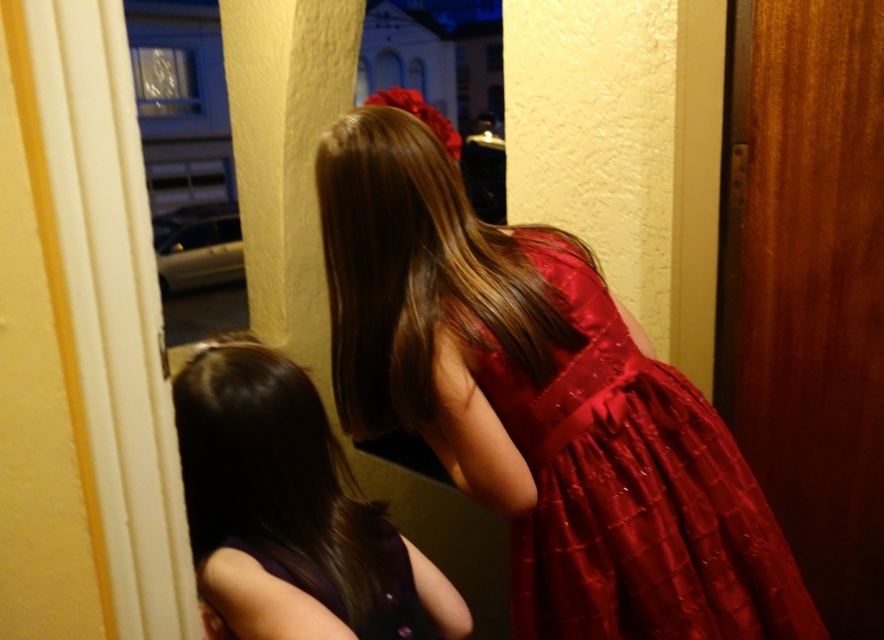
Does shiny red dress at center appear under shiny purple dress at lower left?

Actually, shiny red dress at center is above shiny purple dress at lower left.

In the scene shown: Does shiny red dress at center have a smaller size compared to shiny purple dress at lower left?

No, shiny red dress at center is not smaller than shiny purple dress at lower left.

Does point (713, 445) come in front of point (222, 516)?

No.

The height and width of the screenshot is (640, 884). In order to click on shiny red dress at center in this screenshot , I will do `click(540, 404)`.

Is shiny brown hair at center taller than purple satin dress at lower left?

Correct, shiny brown hair at center is much taller as purple satin dress at lower left.

Between shiny brown hair at center and purple satin dress at lower left, which one has more height?

shiny brown hair at center

The height and width of the screenshot is (640, 884). I want to click on shiny brown hair at center, so click(x=420, y=272).

Based on the photo, is shiny purple dress at lower left wider than purple satin dress at lower left?

Indeed, shiny purple dress at lower left has a greater width compared to purple satin dress at lower left.

Does shiny purple dress at lower left have a lesser height compared to purple satin dress at lower left?

Incorrect, shiny purple dress at lower left's height does not fall short of purple satin dress at lower left's.

Who is more distant from viewer, (377, 504) or (433, 605)?

The point (377, 504) is behind.

This screenshot has width=884, height=640. In order to click on shiny purple dress at lower left in this screenshot , I will do [291, 513].